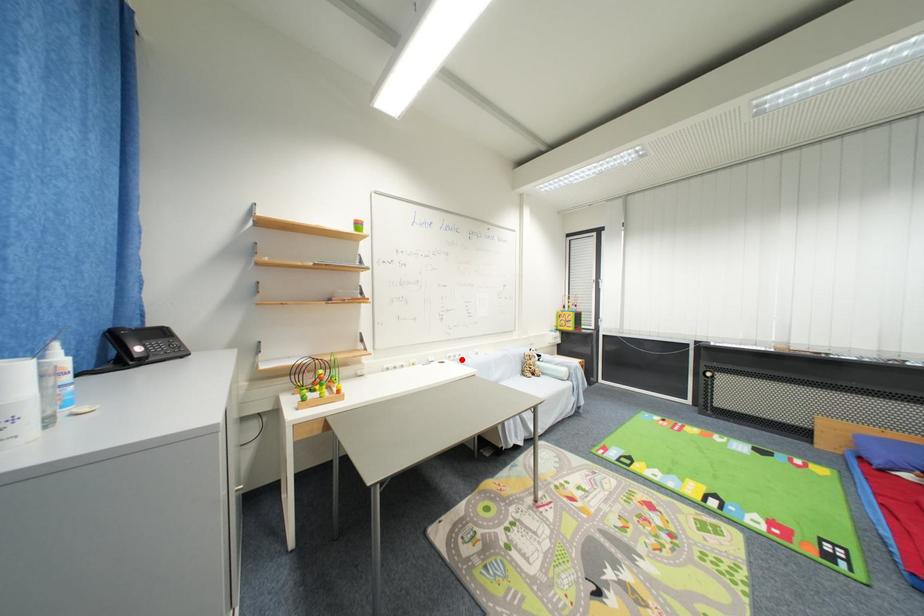
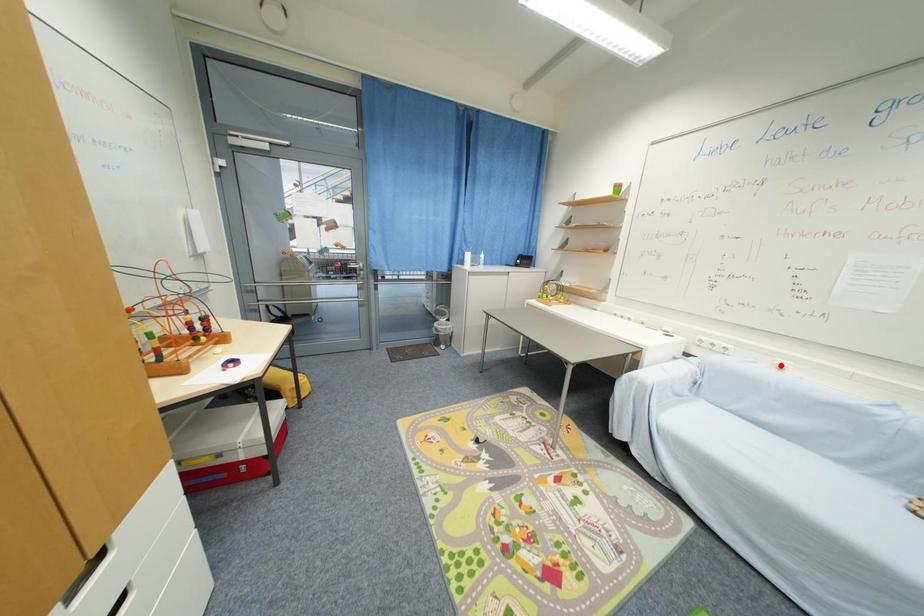
I am providing you with two images of the same scene from different viewpoints. A red point is marked on the first image and another point is marked on the second image. Are the points marked in image1 and image2 representing the same 3D position?

No